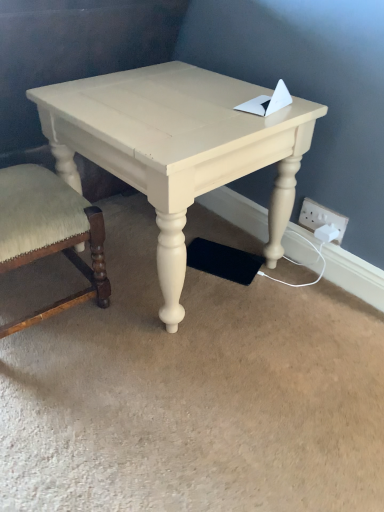
Question: Is matte cream table at center wider than white plastic electric outlet at lower right?

Choices:
 (A) no
 (B) yes

Answer: (B)

Question: Is matte cream table at center oriented away from white plastic electric outlet at lower right?

Choices:
 (A) no
 (B) yes

Answer: (A)

Question: From the image's perspective, does matte cream table at center appear lower than white plastic electric outlet at lower right?

Choices:
 (A) yes
 (B) no

Answer: (B)

Question: Is white plastic electric outlet at lower right completely or partially inside matte cream table at center?

Choices:
 (A) no
 (B) yes

Answer: (A)

Question: Considering the relative positions of matte cream table at center and white plastic electric outlet at lower right in the image provided, is matte cream table at center in front of white plastic electric outlet at lower right?

Choices:
 (A) yes
 (B) no

Answer: (A)

Question: Is matte cream table at center to the right of white plastic electric outlet at lower right from the viewer's perspective?

Choices:
 (A) yes
 (B) no

Answer: (B)

Question: From a real-world perspective, does white plastic electric outlet at lower right stand above velvet beige chair at lower left?

Choices:
 (A) yes
 (B) no

Answer: (A)

Question: Is white plastic electric outlet at lower right next to velvet beige chair at lower left and touching it?

Choices:
 (A) no
 (B) yes

Answer: (A)

Question: Does white plastic electric outlet at lower right appear on the right side of velvet beige chair at lower left?

Choices:
 (A) yes
 (B) no

Answer: (A)

Question: Is white plastic electric outlet at lower right far away from velvet beige chair at lower left?

Choices:
 (A) yes
 (B) no

Answer: (B)

Question: Does white plastic electric outlet at lower right have a greater width compared to velvet beige chair at lower left?

Choices:
 (A) no
 (B) yes

Answer: (A)

Question: From the image's perspective, is white plastic electric outlet at lower right located above velvet beige chair at lower left?

Choices:
 (A) yes
 (B) no

Answer: (A)

Question: Is matte cream table at center positioned in front of velvet beige chair at lower left?

Choices:
 (A) yes
 (B) no

Answer: (A)